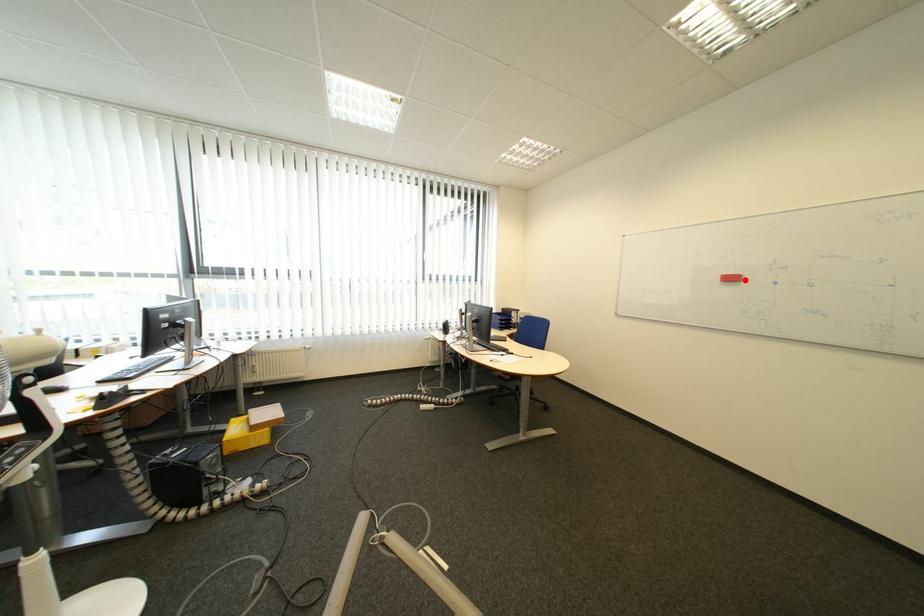
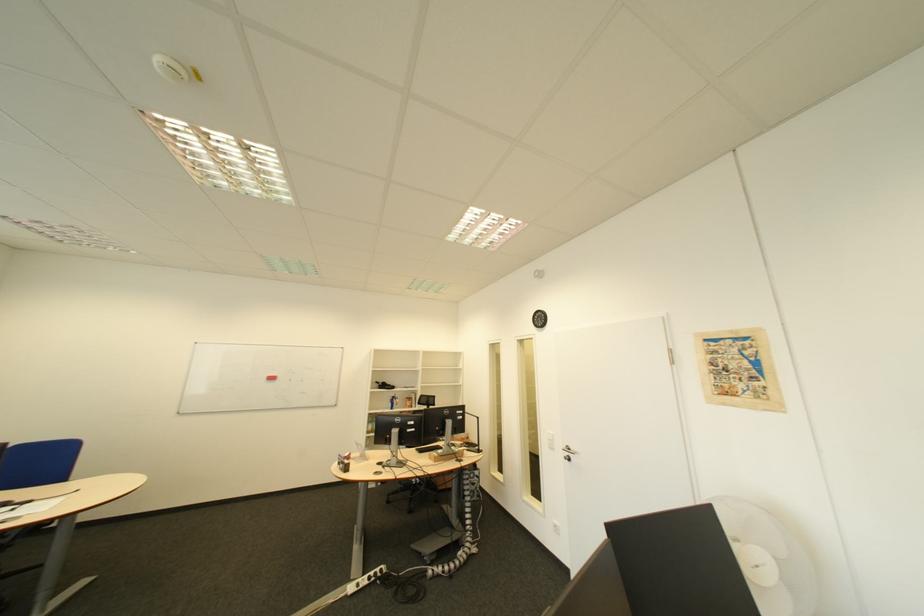
Find the pixel in the second image that matches the highlighted location in the first image.

(285, 379)